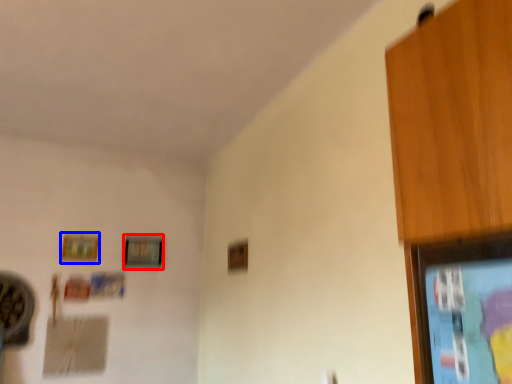
Question: Which object is further to the camera taking this photo, picture frame (highlighted by a red box) or picture frame (highlighted by a blue box)?

Choices:
 (A) picture frame
 (B) picture frame

Answer: (A)